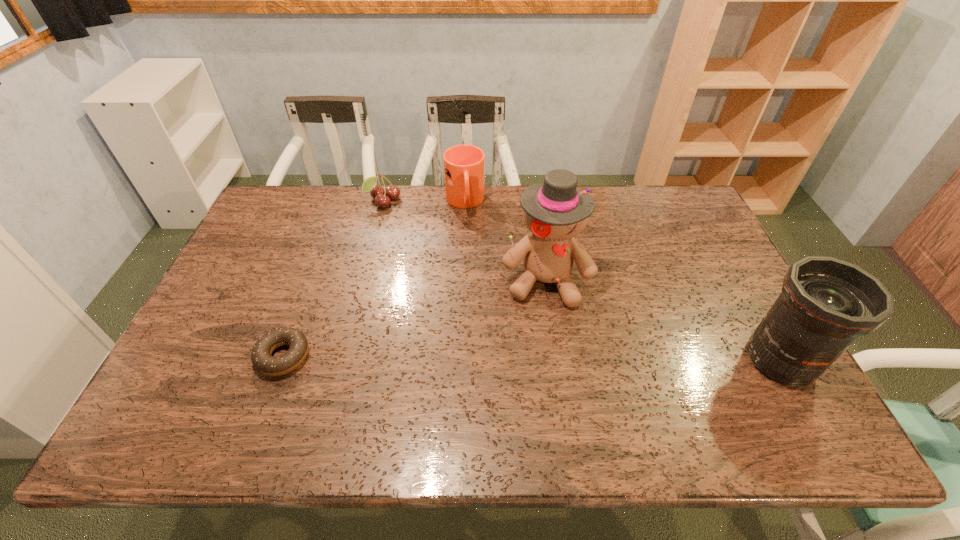
Where is `free space located 0.150m on the right of the leftmost object`? free space located 0.150m on the right of the leftmost object is located at coordinates (371, 356).

Image resolution: width=960 pixels, height=540 pixels. Identify the location of vacant area situated on the back of the telephoto lens. (730, 268).

This screenshot has height=540, width=960. Find the location of `free spot located on the handle side of the third shortest object`. free spot located on the handle side of the third shortest object is located at coordinates (478, 264).

Where is `blank space located on the handle side of the third shortest object`? The width and height of the screenshot is (960, 540). blank space located on the handle side of the third shortest object is located at coordinates (485, 296).

This screenshot has width=960, height=540. In order to click on vacant space located 0.050m on the handle side of the third shortest object in this screenshot , I will do pyautogui.click(x=469, y=230).

I want to click on free space located 0.130m on the front-facing side of the third farthest object, so click(542, 350).

Locate an element on the screen. The height and width of the screenshot is (540, 960). free space located 0.200m on the front-facing side of the third farthest object is located at coordinates coord(541,374).

Identify the location of vacant space located 0.060m on the front-facing side of the third farthest object. (542, 328).

Identify the location of blank space located 0.180m on the leaves of the second object from left to right. This screenshot has height=540, width=960. (414, 240).

In order to click on vacant area located on the leaves of the second object from left to right in this screenshot , I will do `click(416, 243)`.